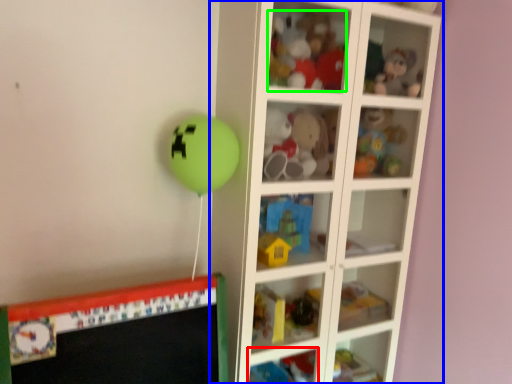
Question: Which is farther away from cabinet (highlighted by a red box)? shelf (highlighted by a blue box) or toy (highlighted by a green box)?

Choices:
 (A) shelf
 (B) toy

Answer: (B)